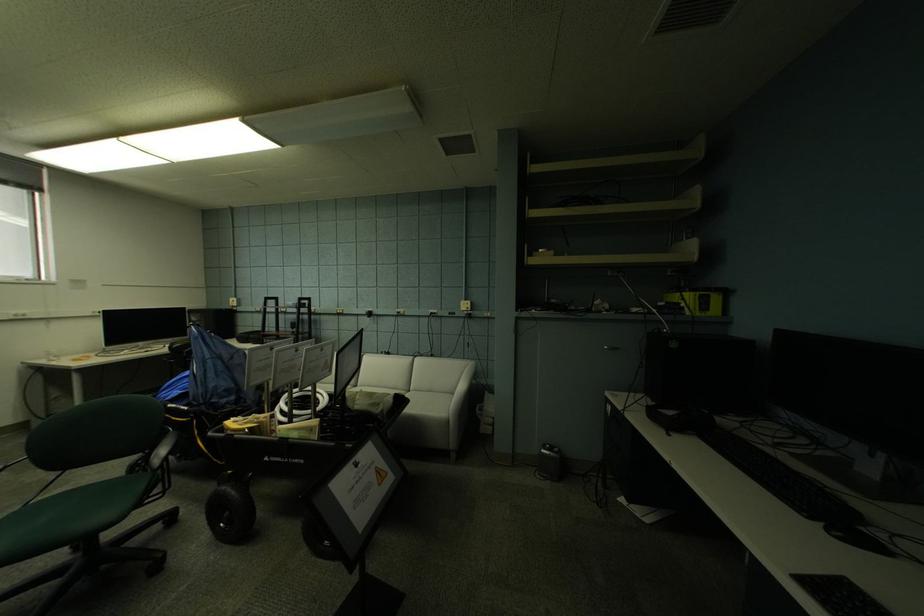
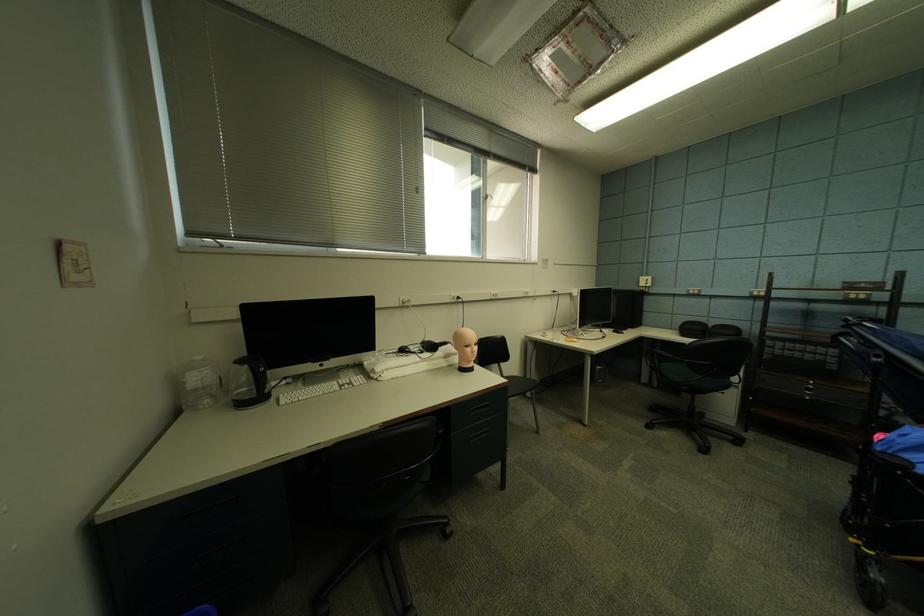
Locate, in the second image, the point that corresponds to the point at 107,315 in the first image.

(561, 294)